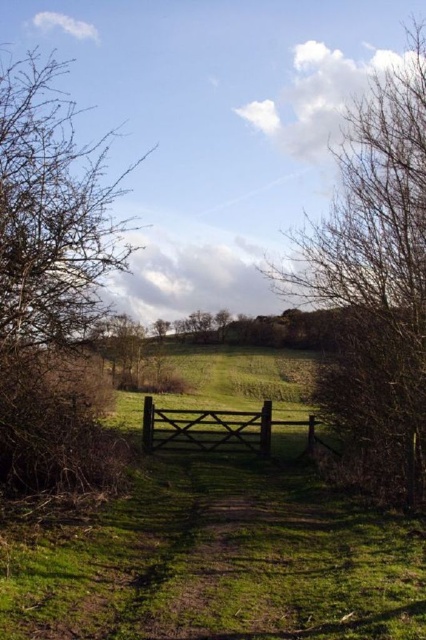
Which is in front, point (40, 355) or point (183, 410)?

Point (40, 355)

Is point (134, 164) in front of point (268, 416)?

No, it is not.

Identify the location of bare branches at left. (51, 285).

Which is in front, point (291, 292) or point (313, 424)?

Point (291, 292) is more forward.

Locate an element on the screen. The image size is (426, 640). bare branches at right is located at coordinates (376, 280).

The image size is (426, 640). I want to click on bare branches at right, so click(376, 280).

Which is behind, point (49, 198) or point (313, 269)?

Positioned behind is point (313, 269).

What do you see at coordinates (51, 285) in the screenshot? I see `bare branches at left` at bounding box center [51, 285].

In order to click on bare branches at left in this screenshot , I will do `click(51, 285)`.